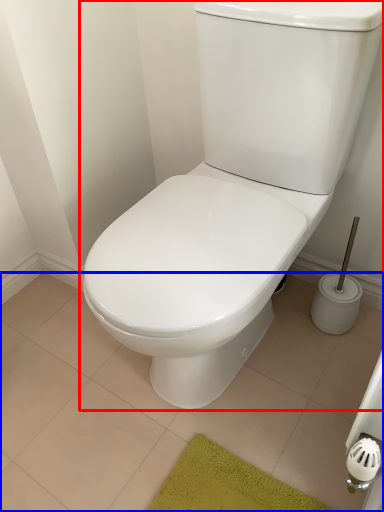
Question: Which point is further to the camera, toilet (highlighted by a red box) or tile (highlighted by a blue box)?

Choices:
 (A) toilet
 (B) tile

Answer: (B)